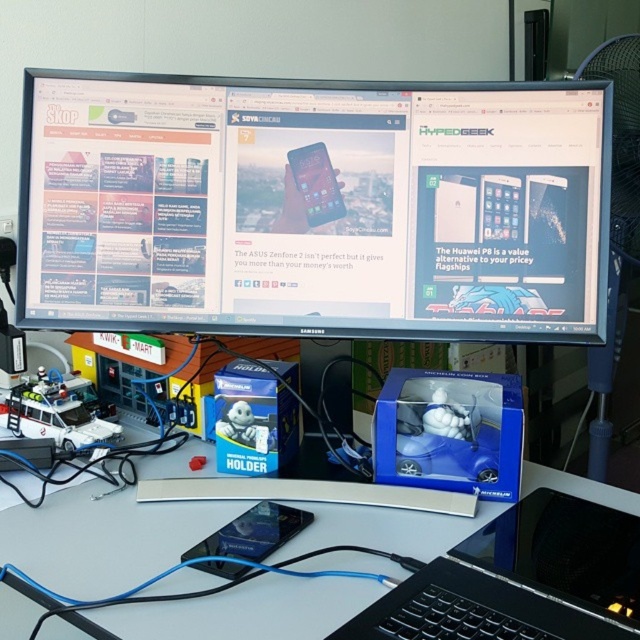
You are a technician who needs to adjust the position of the black glossy monitor at upper center. If your arm can reach up to 100 centimeters, can you comfortably reach the monitor to make adjustments?

The black glossy monitor at upper center is 98.55 centimeters away from the camera, which is within your arm reach of 100 centimeters. Therefore, you can comfortably adjust it.

You are standing in front of the workspace and notice two points on the desk. The first point is at coordinate point [378,326] and the second is at point [161,541]. Which point is closer to you?

Point [378,326] is further to the camera than point [161,541], so the point closer to you is point [161,541].